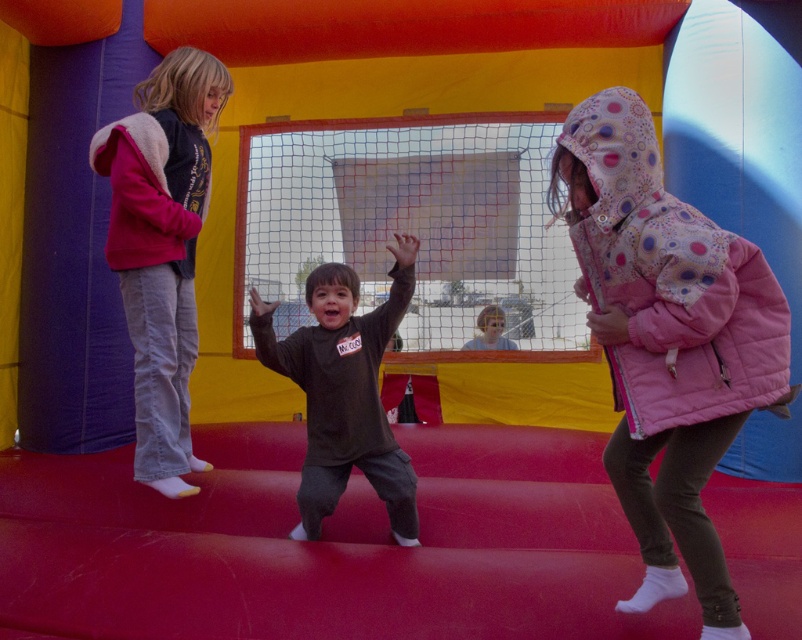
You are a parent trying to locate your child inside the bouncy castle. You see two children wearing pink fleece jackets, one labeled as light pink fleece jacket at left and the other as pink fleece jacket at upper left. If your child is wearing a light pink jacket, which jacket should you look for, and how far apart are the two jackets?

You should look for the light pink fleece jacket at left. The two jackets are 3.03 inches apart.